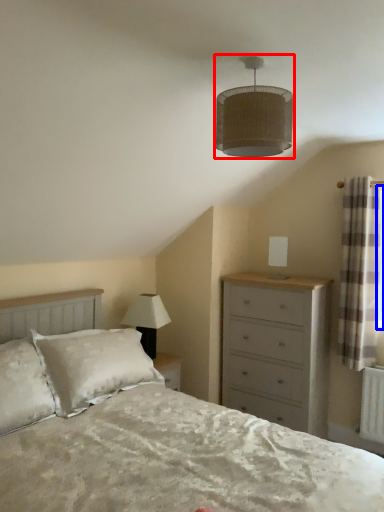
Question: Among these objects, which one is nearest to the camera, lamp (highlighted by a red box) or window screen (highlighted by a blue box)?

Choices:
 (A) lamp
 (B) window screen

Answer: (A)